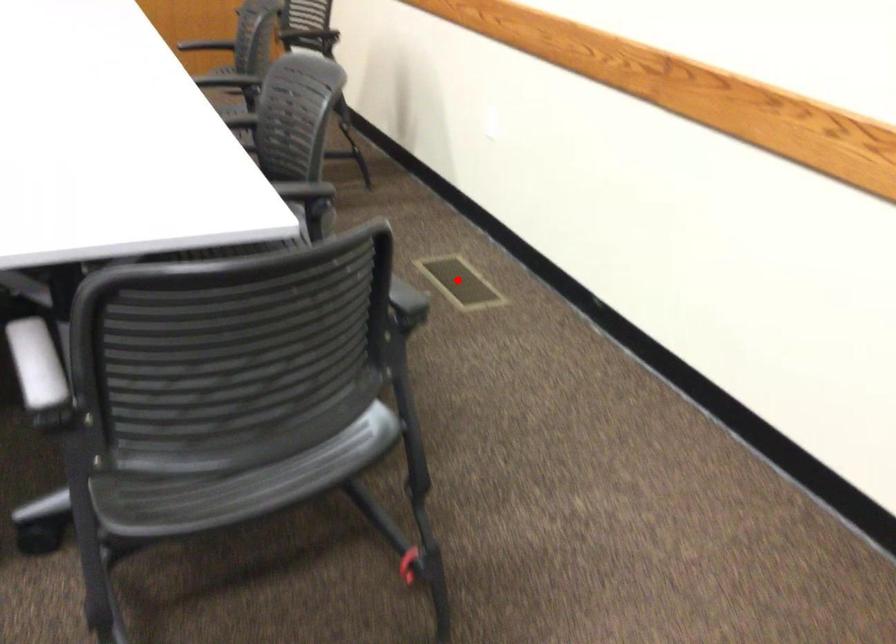
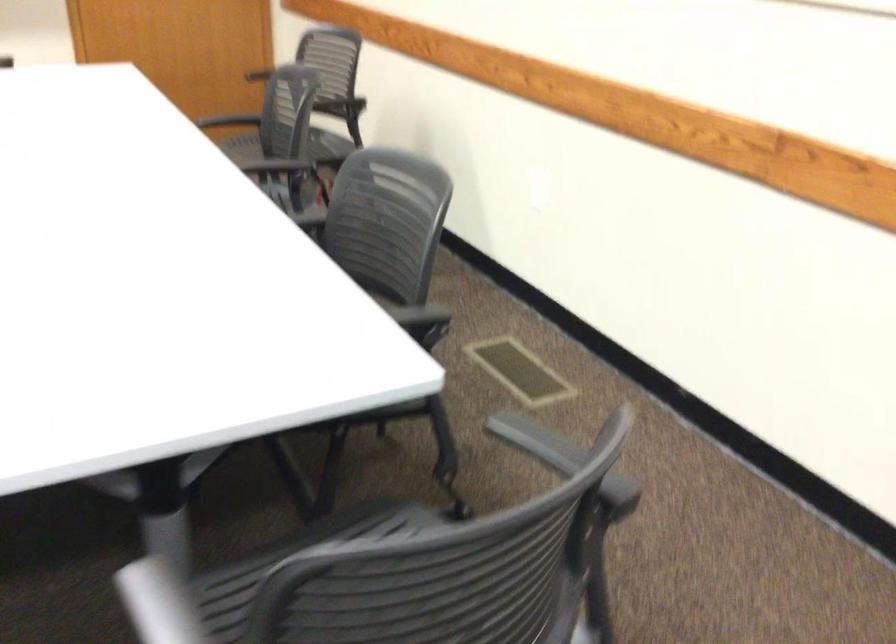
Question: I am providing you with two images of the same scene from different viewpoints. In image1, a red point is highlighted. Considering the same 3D point in image2, which of the following is correct?

Choices:
 (A) It is closer
 (B) It is farther

Answer: (A)